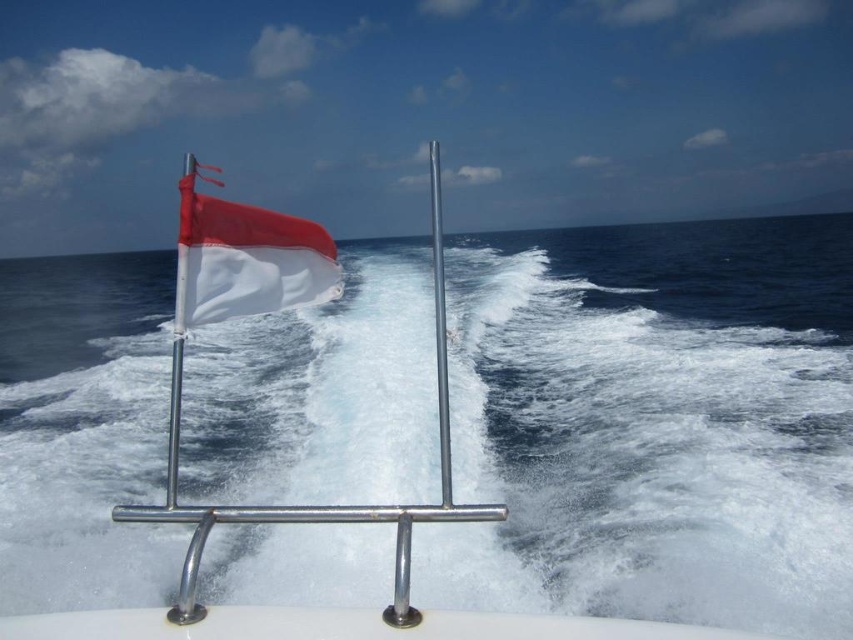
You are on a boat and want to determine which point is closer to you. You see two points marked on the railing and the flagpole. The first point is at coordinates point [805,324] and the second is at point [440,300]. Which point is closer to you?

Point [440,300] is closer to you because it is less further away than point [805,324], which is further away from you.